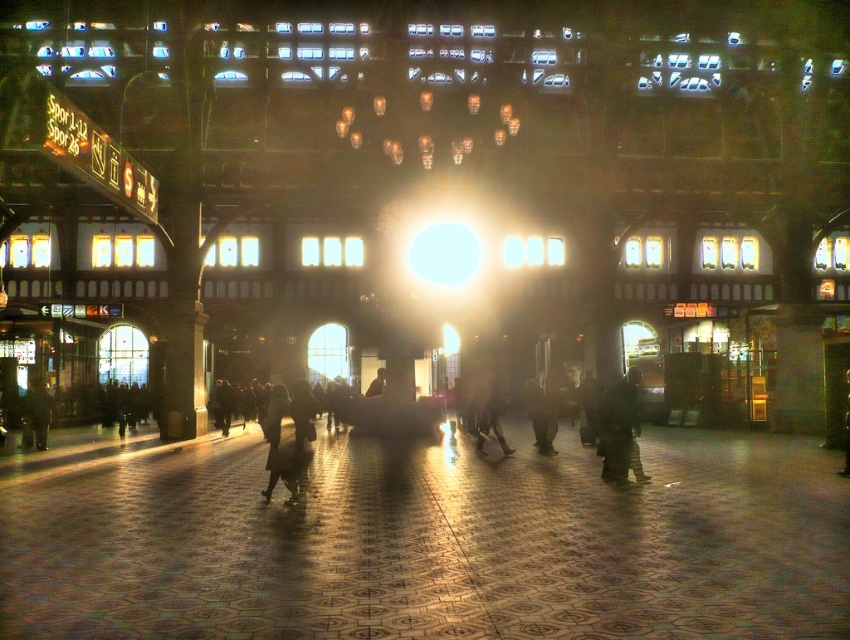
You are standing in the train station and see the dark gray pants at center and the dark green fabric jacket at center. Which one is positioned to the left?

The dark gray pants at center are to the left of the dark green fabric jacket at center.

You are standing in the grand train station and notice a person wearing dark gray pants at center. If you want to take a photo of them without the bright light source in the background, where should you position yourself relative to their current location?

Since the bright light source is at the center of the image and the dark gray pants at center are positioned at point (x=289, y=435), you should move to the side opposite the light source to avoid it in the background when photographing the person.